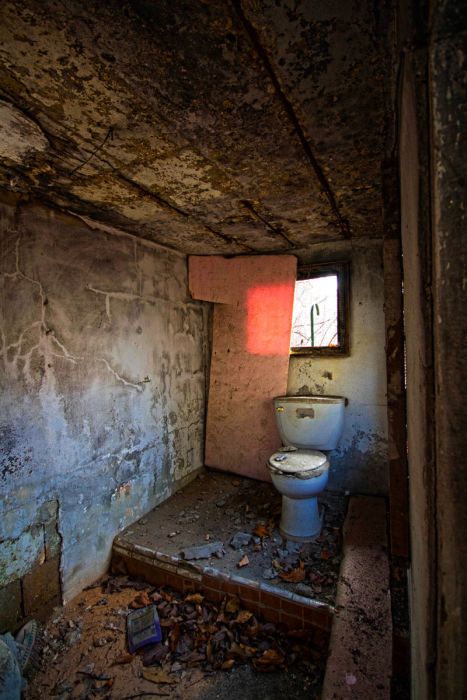
The height and width of the screenshot is (700, 467). Identify the location of light source. (299, 308).